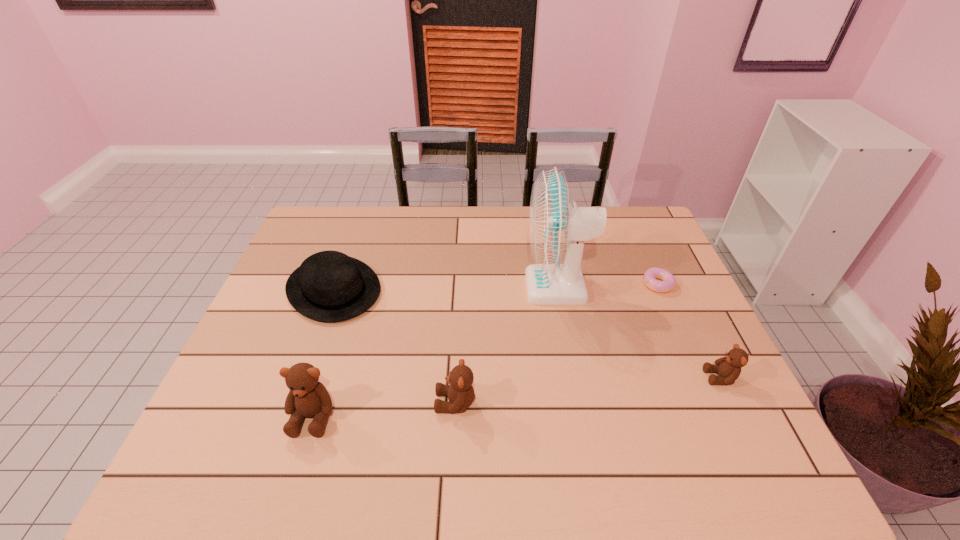
To ensure equal spacing by inserting another teddy_bear among them, please point out a vacant spot for this new teddy_bear. Please provide its 2D coordinates. Your answer should be formatted as a tuple, i.e. [(x, y)], where the tuple contains the x and y coordinates of a point satisfying the conditions above.

[(591, 390)]